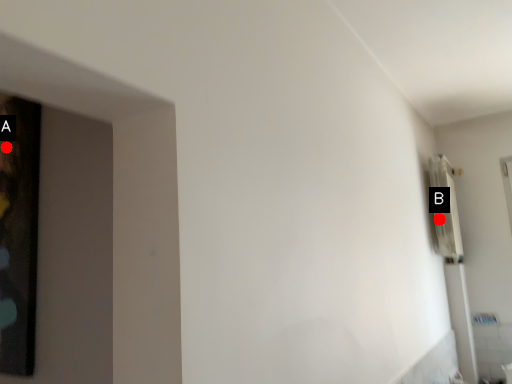
Question: Two points are circled on the image, labeled by A and B beside each circle. Which point is farther from the camera taking this photo?

Choices:
 (A) A is further
 (B) B is further

Answer: (B)